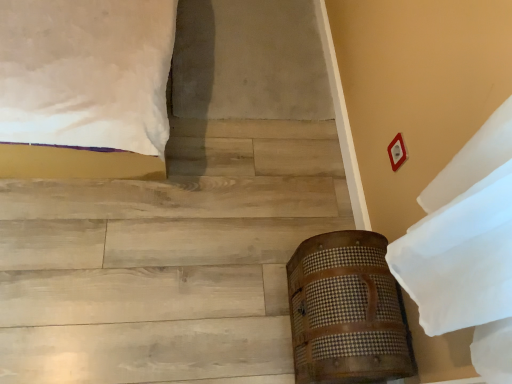
Image resolution: width=512 pixels, height=384 pixels. What do you see at coordinates (347, 311) in the screenshot?
I see `brown woven suitcase at center` at bounding box center [347, 311].

At what (x,y) coordinates should I click in order to perform the action: click on brown woven suitcase at center. Please return your answer as a coordinate pair (x, y). The height and width of the screenshot is (384, 512). Looking at the image, I should click on (347, 311).

The width and height of the screenshot is (512, 384). Find the location of `brown woven suitcase at center`. brown woven suitcase at center is located at coordinates (347, 311).